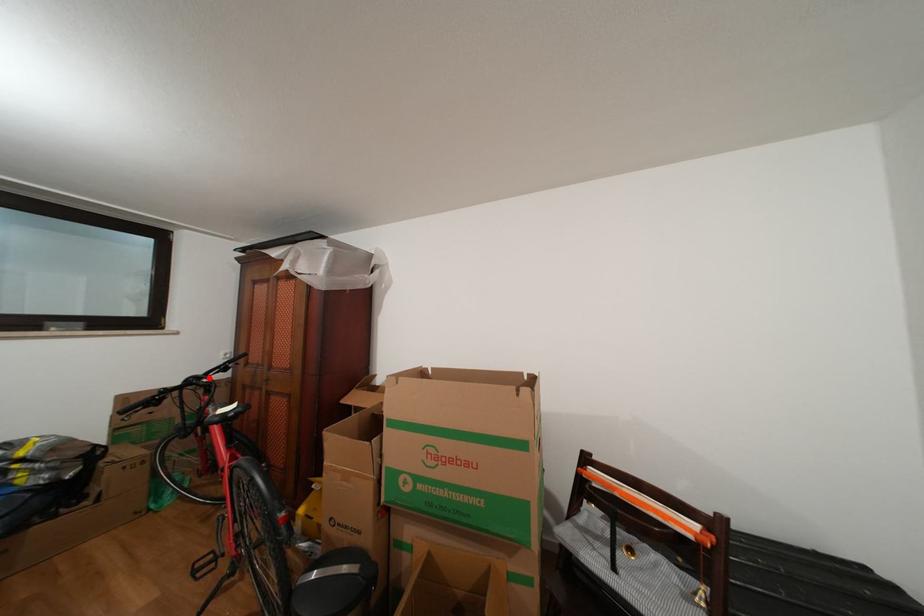
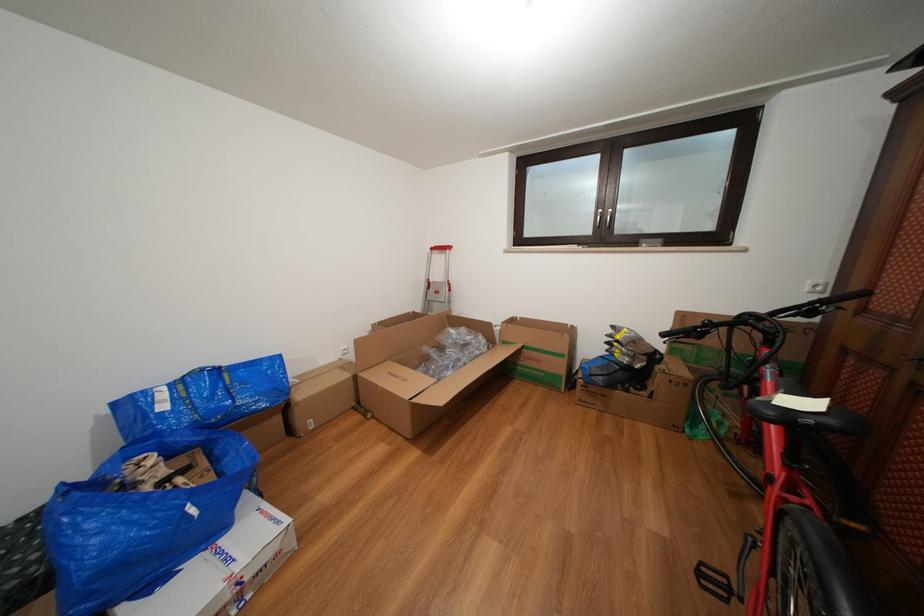
Locate, in the second image, the point that corresponds to the highlighted location in the first image.

(772, 315)